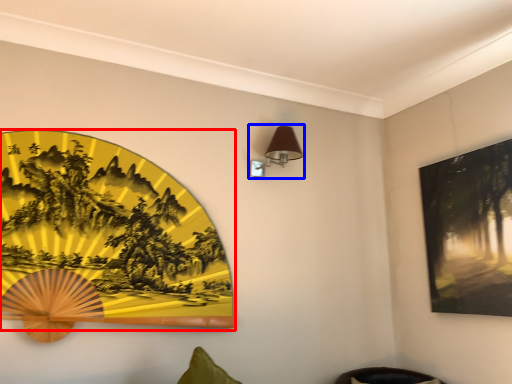
Question: Among these objects, which one is farthest to the camera, picture frame (highlighted by a red box) or table lamp (highlighted by a blue box)?

Choices:
 (A) picture frame
 (B) table lamp

Answer: (B)